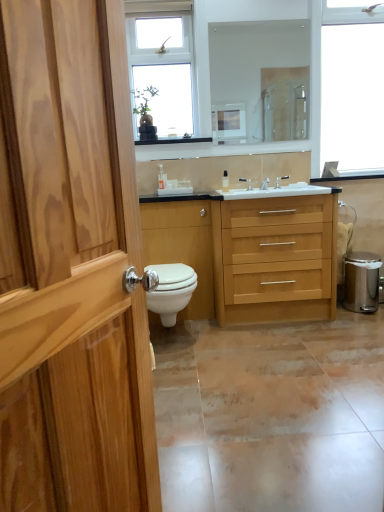
You are a GUI agent. You are given a task and a screenshot of the screen. Output one action in this format:
    pyautogui.click(x=<x>, y=<y>)
    Task: Click on the free space in front of clear plastic bottle at center, the 1th toiletry in the left-to-right sequence
    This screenshot has width=384, height=512.
    Given the screenshot: What is the action you would take?
    pyautogui.click(x=158, y=193)